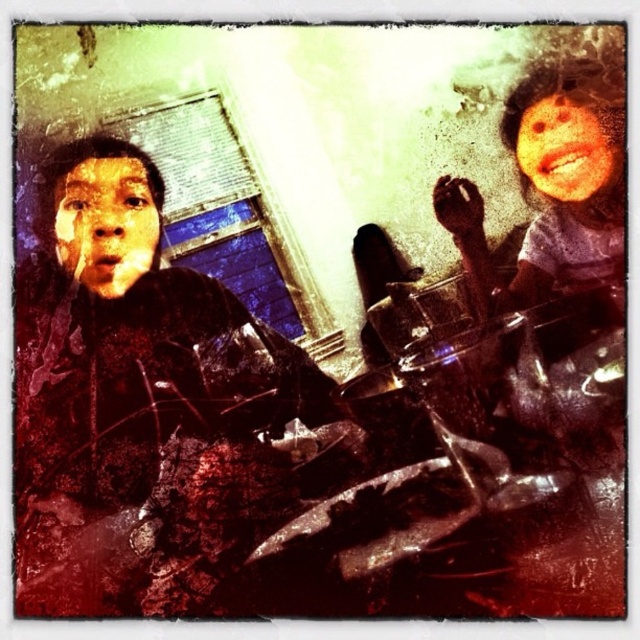
You are a photographer analyzing this vintage photo. You notice two faces in the image. The first is a matte black face at left, and the second is a smooth skin face at upper right. Based on their positions, which face is closer to the left edge of the photo?

The matte black face at left is closer to the left edge of the photo because it is positioned to the left of the smooth skin face at upper right.

You are an AI analyzing a vintage photo. The scene has two children, one on the left and one on the right. The coordinates point at a specific location. Is the point at [106,224] located on the left child or the right child?

The point at [106,224] is located on the matte black face at left, so it is on the left child.